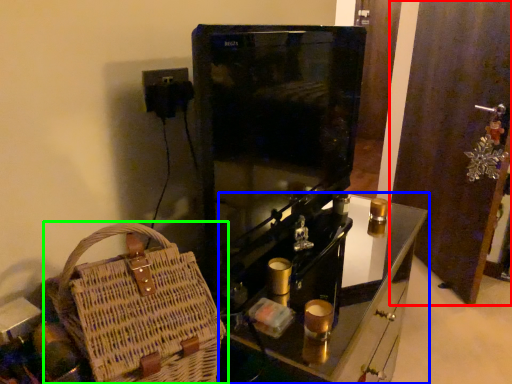
Question: Which object is positioned closest to door (highlighted by a red box)? Select from furniture (highlighted by a blue box) and handbag (highlighted by a green box).

Choices:
 (A) furniture
 (B) handbag

Answer: (A)